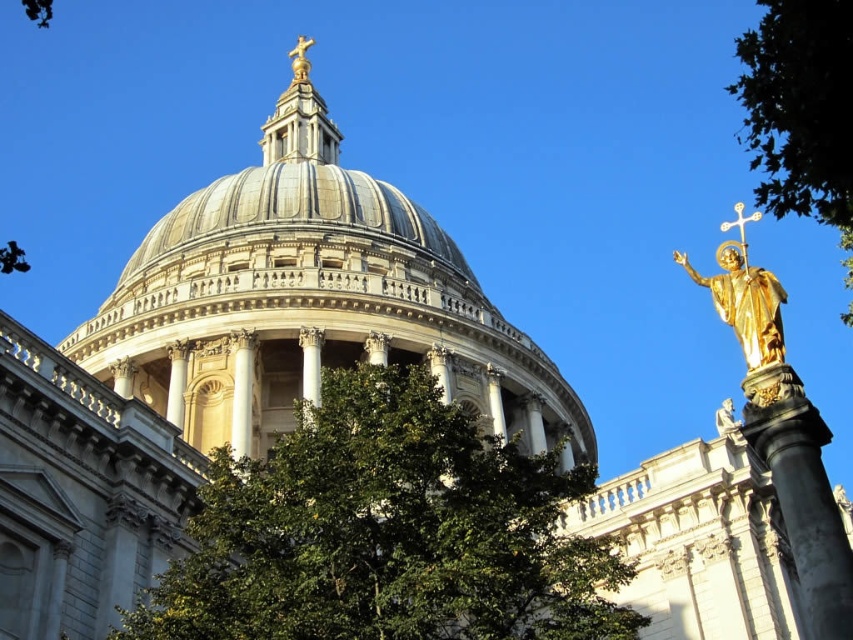
The height and width of the screenshot is (640, 853). Identify the location of green leafy tree at center. (386, 532).

Who is more forward, (212, 592) or (294, 58)?

Positioned in front is point (212, 592).

In order to click on green leafy tree at center in this screenshot , I will do `click(386, 532)`.

Locate an element on the screen. The height and width of the screenshot is (640, 853). dark gray stone column at right is located at coordinates (802, 493).

Is dark gray stone column at right to the right of metallic gold cross at upper right from the viewer's perspective?

No, dark gray stone column at right is not to the right of metallic gold cross at upper right.

This screenshot has height=640, width=853. Describe the element at coordinates (802, 493) in the screenshot. I see `dark gray stone column at right` at that location.

Where is `dark gray stone column at right`? The image size is (853, 640). dark gray stone column at right is located at coordinates (802, 493).

Between green leafy tree at center and metallic gold cross at upper right, which one appears on the left side from the viewer's perspective?

From the viewer's perspective, green leafy tree at center appears more on the left side.

Does green leafy tree at center have a smaller size compared to metallic gold cross at upper right?

Yes.

Who is more distant from viewer, (309, 576) or (743, 248)?

The point (743, 248) is more distant.

The height and width of the screenshot is (640, 853). Find the location of `green leafy tree at center`. green leafy tree at center is located at coordinates (386, 532).